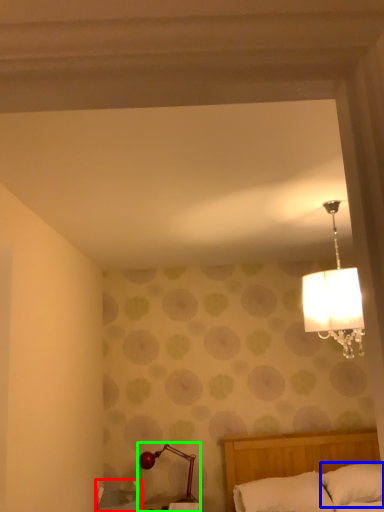
Question: Based on their relative distances, which object is farther from furniture (highlighted by a red box)? Choose from pillow (highlighted by a blue box) and lamp (highlighted by a green box).

Choices:
 (A) pillow
 (B) lamp

Answer: (A)